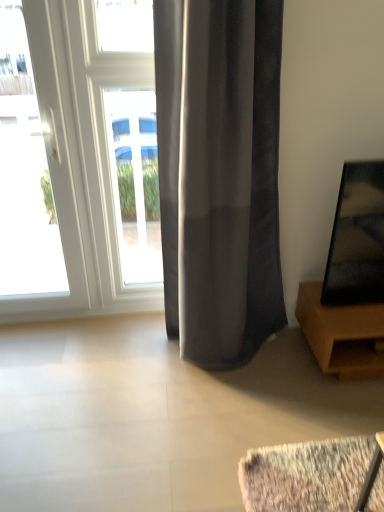
Question: From a real-world perspective, is white glossy door at left beneath white glossy window at center?

Choices:
 (A) no
 (B) yes

Answer: (A)

Question: Can you confirm if white glossy door at left is positioned to the left of white glossy window at center?

Choices:
 (A) yes
 (B) no

Answer: (A)

Question: Is white glossy door at left closer to camera compared to white glossy window at center?

Choices:
 (A) no
 (B) yes

Answer: (B)

Question: From a real-world perspective, does white glossy door at left stand above white glossy window at center?

Choices:
 (A) yes
 (B) no

Answer: (A)

Question: Does white glossy door at left have a lesser height compared to white glossy window at center?

Choices:
 (A) yes
 (B) no

Answer: (B)

Question: Is white glossy door at left at the right side of white glossy window at center?

Choices:
 (A) no
 (B) yes

Answer: (A)

Question: Considering the relative positions of white glossy window at center and satin gray curtain at center in the image provided, is white glossy window at center to the left of satin gray curtain at center from the viewer's perspective?

Choices:
 (A) no
 (B) yes

Answer: (B)

Question: Is white glossy window at center with satin gray curtain at center?

Choices:
 (A) yes
 (B) no

Answer: (B)

Question: Considering the relative sizes of white glossy window at center and satin gray curtain at center in the image provided, is white glossy window at center wider than satin gray curtain at center?

Choices:
 (A) yes
 (B) no

Answer: (B)

Question: From a real-world perspective, is white glossy window at center physically below satin gray curtain at center?

Choices:
 (A) yes
 (B) no

Answer: (A)

Question: Is white glossy window at center thinner than satin gray curtain at center?

Choices:
 (A) yes
 (B) no

Answer: (A)

Question: From the image's perspective, is white glossy window at center under satin gray curtain at center?

Choices:
 (A) yes
 (B) no

Answer: (B)

Question: Could brown wooden tv stand at right be considered to be inside satin gray curtain at center?

Choices:
 (A) no
 (B) yes

Answer: (A)